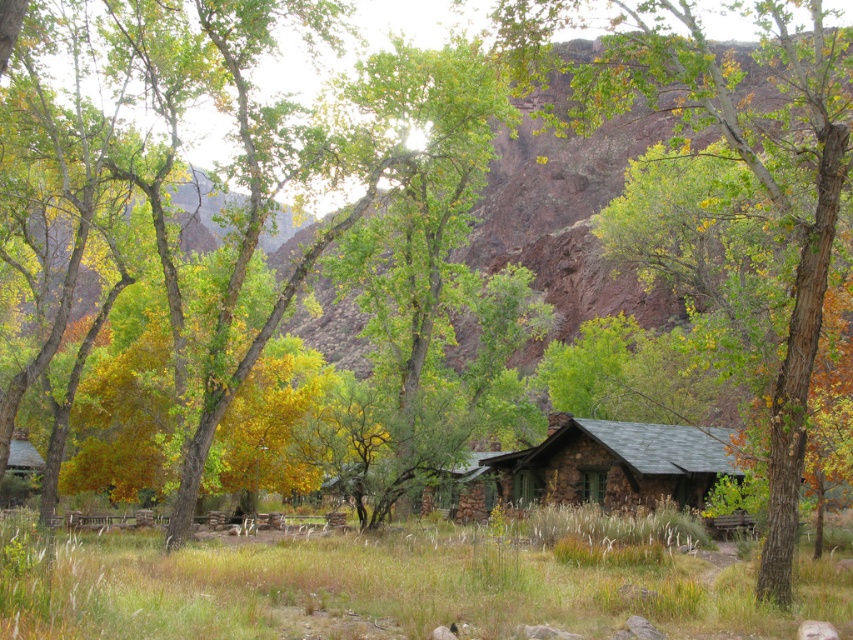
Is green grass at lower center further to the viewer compared to rustic stone cabin at center?

No, green grass at lower center is in front of rustic stone cabin at center.

Is green grass at lower center shorter than rustic stone cabin at center?

Correct, green grass at lower center is not as tall as rustic stone cabin at center.

Does point (97, 560) come behind point (654, 451)?

That is False.

You are a GUI agent. You are given a task and a screenshot of the screen. Output one action in this format:
    pyautogui.click(x=<x>, y=<y>)
    Task: Click on the green grass at lower center
    The height and width of the screenshot is (640, 853).
    Given the screenshot: What is the action you would take?
    pyautogui.click(x=383, y=586)

Between point (666, 48) and point (548, 444), which one is positioned behind?

Point (548, 444)

Can you confirm if green leafy tree at center is positioned above rustic stone cabin at center?

Indeed, green leafy tree at center is positioned over rustic stone cabin at center.

Is point (782, 173) more distant than point (653, 493)?

No, (782, 173) is closer to viewer.

You are a GUI agent. You are given a task and a screenshot of the screen. Output one action in this format:
    pyautogui.click(x=<x>, y=<y>)
    Task: Click on the green leafy tree at center
    
    Given the screenshot: What is the action you would take?
    pyautogui.click(x=752, y=179)

Between green grass at lower center and green leafy tree at center, which one appears on the right side from the viewer's perspective?

From the viewer's perspective, green leafy tree at center appears more on the right side.

Is point (163, 616) positioned after point (807, 266)?

No, it is in front of (807, 266).

Identify the location of green grass at lower center. The height and width of the screenshot is (640, 853). (383, 586).